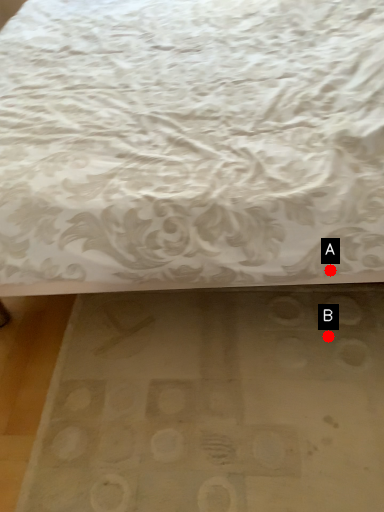
Question: Two points are circled on the image, labeled by A and B beside each circle. Which point appears closest to the camera in this image?

Choices:
 (A) A is closer
 (B) B is closer

Answer: (A)